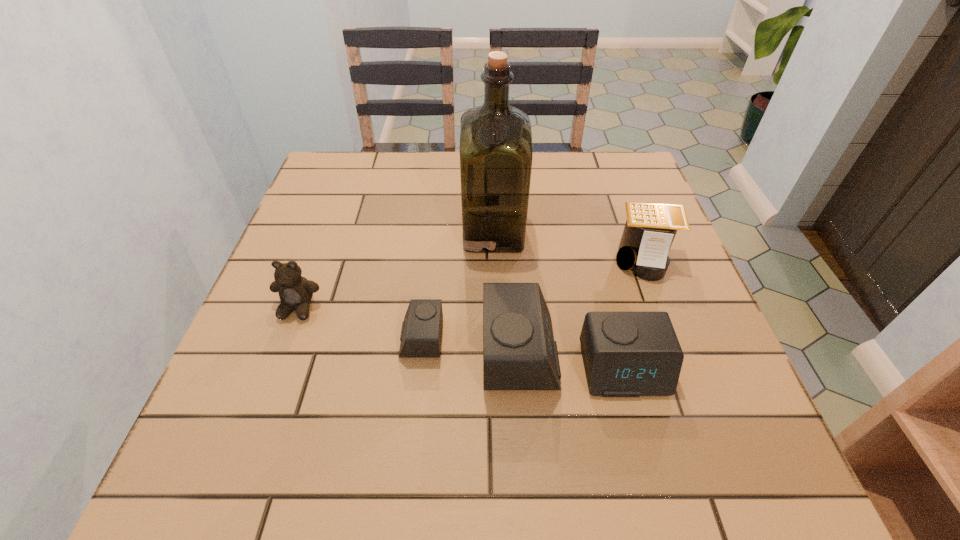
Where is `vacant area situated on the front-facing side of the second object from left to right`? vacant area situated on the front-facing side of the second object from left to right is located at coordinates (366, 339).

This screenshot has height=540, width=960. I want to click on vacant space situated on the front-facing side of the second alarm clock from left to right, so click(x=630, y=353).

At what (x,y) coordinates should I click in order to perform the action: click on vacant space situated on the front-facing side of the rightmost alarm clock. Please return your answer as a coordinate pair (x, y). Image resolution: width=960 pixels, height=540 pixels. Looking at the image, I should click on (638, 425).

At what (x,y) coordinates should I click in order to perform the action: click on blank space located 0.300m on the back of the calculator. Please return your answer as a coordinate pair (x, y). The image size is (960, 540). Looking at the image, I should click on (612, 171).

Image resolution: width=960 pixels, height=540 pixels. In order to click on vacant space located 0.280m on the label of the tallest object in this screenshot , I will do click(350, 232).

You are a GUI agent. You are given a task and a screenshot of the screen. Output one action in this format:
    pyautogui.click(x=<x>, y=<y>)
    Task: Click on the blank area located 0.190m on the label of the tallest object
    This screenshot has height=540, width=960.
    Given the screenshot: What is the action you would take?
    pyautogui.click(x=387, y=232)

Find the location of a particular element. The width and height of the screenshot is (960, 540). free spot located on the label of the tallest object is located at coordinates (444, 232).

Locate an element on the screen. This screenshot has width=960, height=540. vacant space located on the face of the leftmost object is located at coordinates (266, 394).

Image resolution: width=960 pixels, height=540 pixels. Identify the location of object at the left edge. (295, 292).

I want to click on alarm clock situated at the right edge, so click(x=626, y=354).